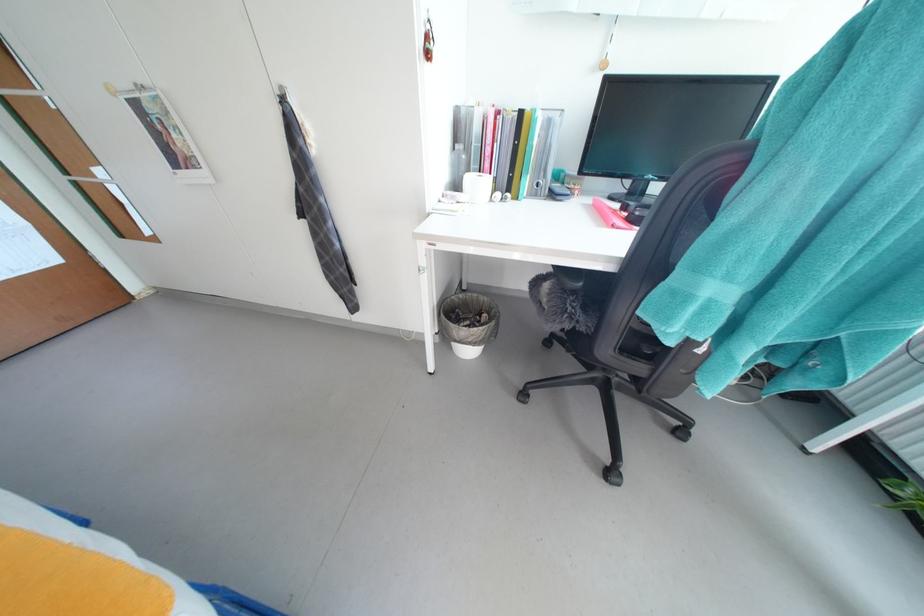
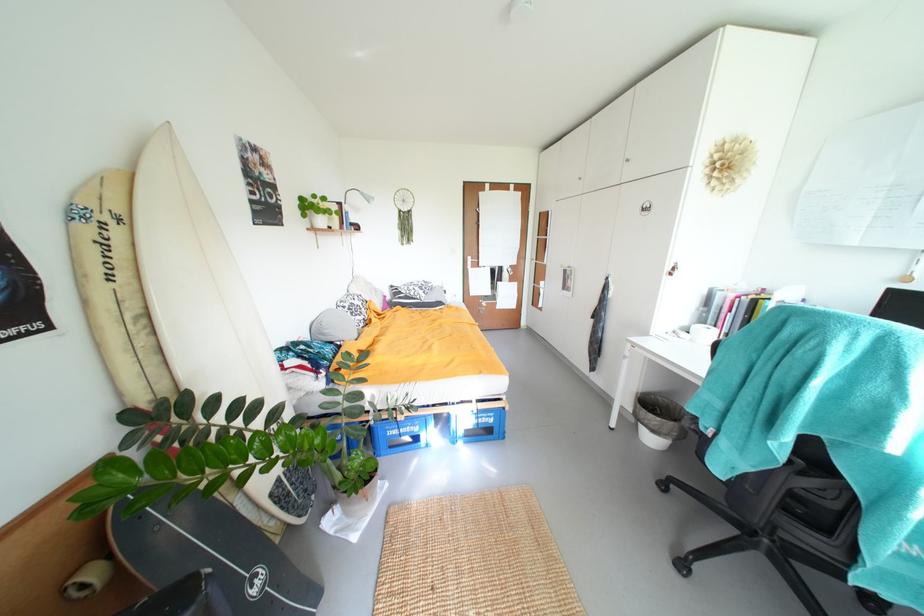
The point at (428, 41) is marked in the first image. Where is the corresponding point in the second image?

(675, 270)